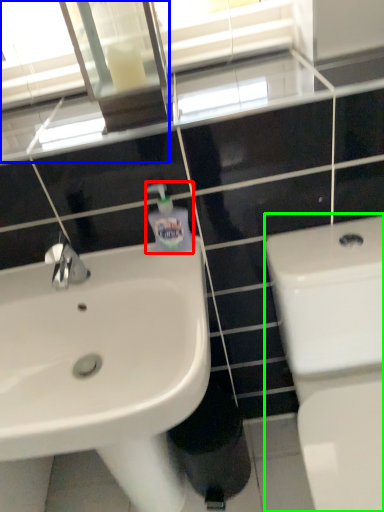
Question: Estimate the real-world distances between objects in this image. Which object is closer to soap dispenser (highlighted by a red box), mirror (highlighted by a blue box) or toilet (highlighted by a green box)?

Choices:
 (A) mirror
 (B) toilet

Answer: (B)